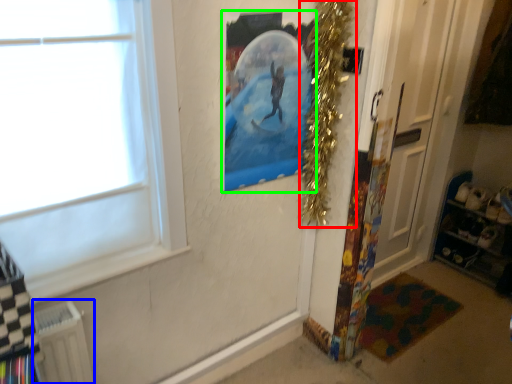
Question: Which object is the closest to the christmas decoration (highlighted by a red box)? Choose among these: radiator (highlighted by a blue box) or picture frame (highlighted by a green box).

Choices:
 (A) radiator
 (B) picture frame

Answer: (B)